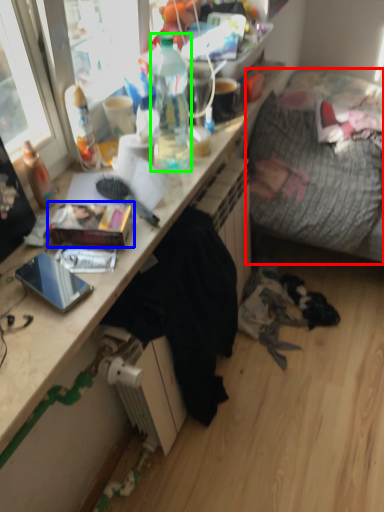
Question: Based on their relative distances, which object is farther from studio couch (highlighted by a red box)? Choose from book (highlighted by a blue box) and bottle (highlighted by a green box).

Choices:
 (A) book
 (B) bottle

Answer: (A)